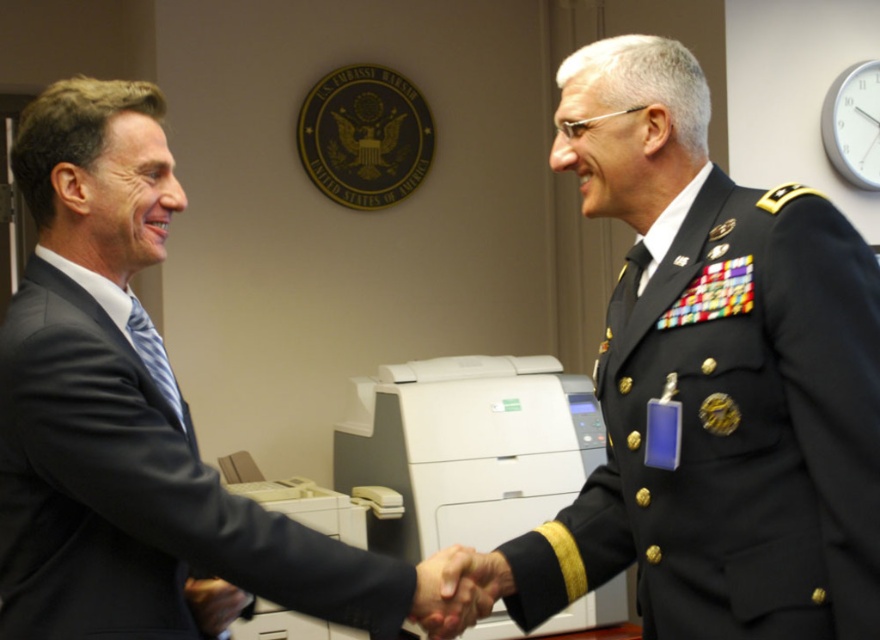
Question: Where is smooth skin handshake at center located in relation to matte black hand at center in the image?

Choices:
 (A) left
 (B) right

Answer: (B)

Question: Which of these objects is positioned farthest from the smooth skin handshake at center?

Choices:
 (A) white plastic printer at center
 (B) black military uniform at right

Answer: (A)

Question: Which point is closer to the camera?

Choices:
 (A) smooth skin handshake at center
 (B) black military uniform at right
 (C) dark blue wool suit at center

Answer: (B)

Question: Which point appears farthest from the camera in this image?

Choices:
 (A) pyautogui.click(x=104, y=520)
 (B) pyautogui.click(x=501, y=566)
 (C) pyautogui.click(x=411, y=413)
 (D) pyautogui.click(x=231, y=616)

Answer: (C)

Question: Observing the image, what is the correct spatial positioning of white plastic printer at center in reference to smooth skin handshake at center?

Choices:
 (A) left
 (B) right

Answer: (B)

Question: Observing the image, what is the correct spatial positioning of smooth skin handshake at center in reference to matte black hand at center?

Choices:
 (A) left
 (B) right

Answer: (B)